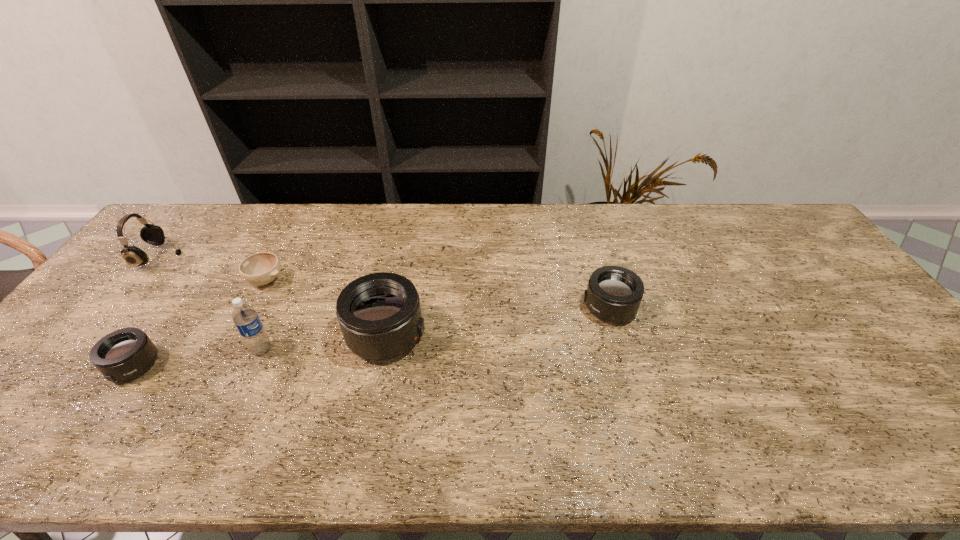
Locate an element on the screen. The height and width of the screenshot is (540, 960). free space at the far edge is located at coordinates (678, 239).

Locate an element on the screen. The image size is (960, 540). vacant space at the near edge of the desktop is located at coordinates (755, 415).

Where is `vacant region at the left edge of the desktop`? This screenshot has width=960, height=540. vacant region at the left edge of the desktop is located at coordinates (103, 327).

What are the coordinates of `free space at the right edge` in the screenshot? It's located at (912, 380).

Identify the location of free space at the far right corner of the desktop. (791, 239).

This screenshot has height=540, width=960. In order to click on vacant area at the near right corner in this screenshot , I will do `click(901, 395)`.

The height and width of the screenshot is (540, 960). I want to click on free space between the shortest telephoto lens and the leftmost object, so click(147, 311).

Identify the location of free space between the water bottle and the headset. The height and width of the screenshot is (540, 960). (211, 303).

Identify the location of free space between the shortest telephoto lens and the shortest object. The height and width of the screenshot is (540, 960). (200, 323).

The width and height of the screenshot is (960, 540). Find the location of `free point between the second telephoto lens from right to left and the tallest object`. free point between the second telephoto lens from right to left and the tallest object is located at coordinates (324, 342).